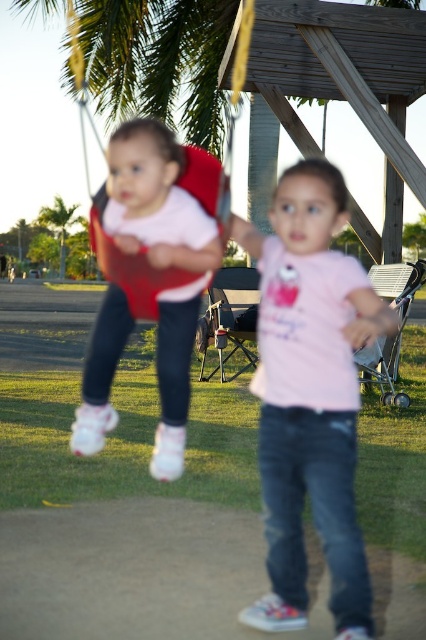
You are a parent trying to keep an eye on your children. You are standing at the edge of the park near the grassy area. Which child is closer to you, the one wearing the pink matte shirt at center or the one on the red fabric swing at left?

The pink matte shirt at center is closer to you than the red fabric swing at left because they are 1.75 meters apart, so the child in the pink shirt is nearer.

You are a photographer trying to capture both the pink matte shirt at center and the red fabric swing at left in a single shot. Based on their sizes in the image, which object should you focus on first to ensure both are in frame?

The pink matte shirt at center occupies less space than the red fabric swing at left, so you should focus on the red fabric swing at left first to ensure both are in frame.

You are a photographer trying to capture both children in the scene. Since you want to ensure that both the pink matte shirt at center and the matte pink shirt at left are clearly visible in your photo, which child should you focus on first to ensure proper exposure?

The pink matte shirt at center has a larger size compared to matte pink shirt at left, so you should focus on the pink matte shirt at center first to ensure proper exposure.